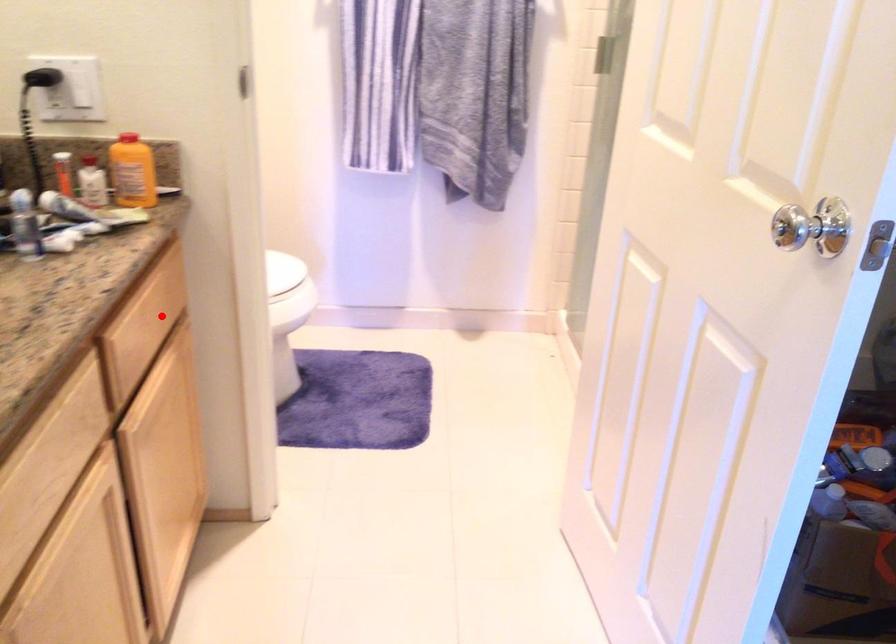
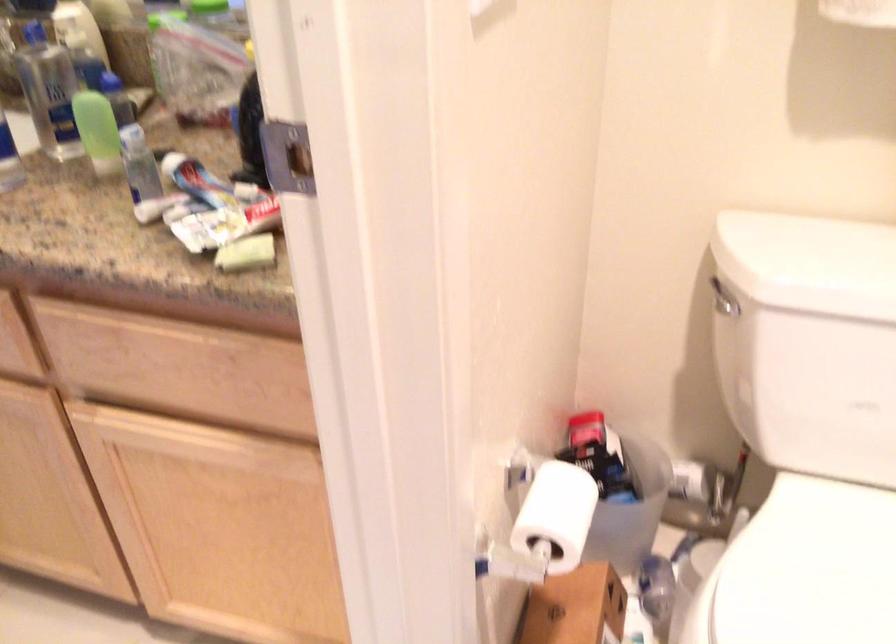
Question: I am providing you with two images of the same scene from different viewpoints. In image1, a red point is highlighted. Considering the same 3D point in image2, which of the following is correct?

Choices:
 (A) It is closer
 (B) It is farther

Answer: (A)